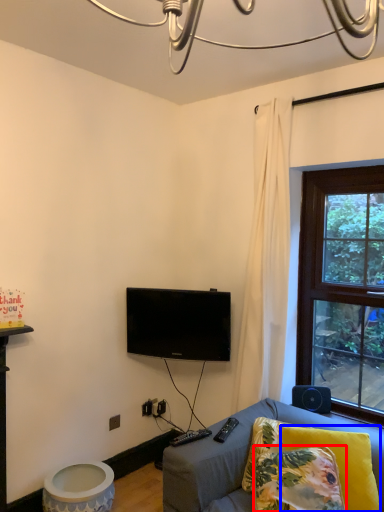
Question: Among these objects, which one is farthest to the camera, pillow (highlighted by a red box) or pillow (highlighted by a blue box)?

Choices:
 (A) pillow
 (B) pillow

Answer: (B)